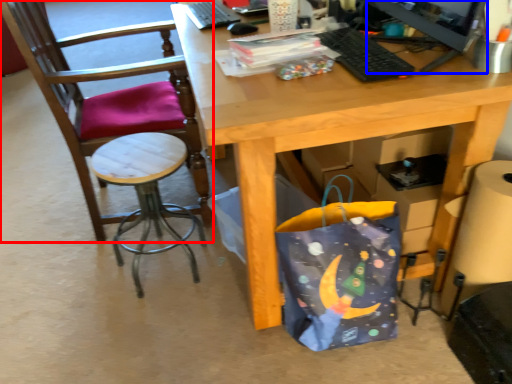
Question: Among these objects, which one is farthest to the camera, chair (highlighted by a red box) or computer monitor (highlighted by a blue box)?

Choices:
 (A) chair
 (B) computer monitor

Answer: (A)